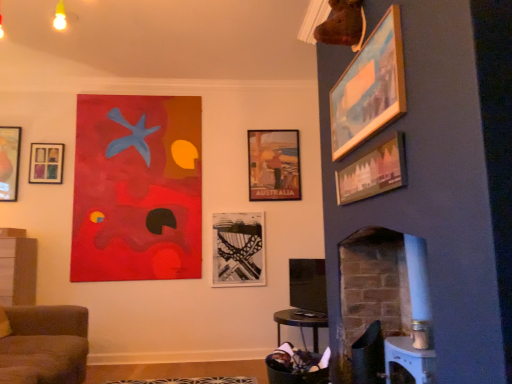
Question: Can you confirm if matte wooden picture frame at upper right, marked as the 5th picture frame in a left-to-right arrangement, is positioned to the right of wooden picture frame at upper right, which appears as the second picture frame when viewed from the front?

Choices:
 (A) yes
 (B) no

Answer: (B)

Question: Considering the relative sizes of matte wooden picture frame at upper right, the 1th picture frame in the front-to-back sequence, and wooden picture frame at upper right, which appears as the second picture frame when viewed from the front, in the image provided, is matte wooden picture frame at upper right, the 1th picture frame in the front-to-back sequence, bigger than wooden picture frame at upper right, which appears as the second picture frame when viewed from the front,?

Choices:
 (A) yes
 (B) no

Answer: (B)

Question: Can you confirm if matte wooden picture frame at upper right, the 1th picture frame in the front-to-back sequence, is shorter than wooden picture frame at upper right, placed as the fifth picture frame when sorted from back to front?

Choices:
 (A) no
 (B) yes

Answer: (B)

Question: Is the surface of matte wooden picture frame at upper right, marked as the 5th picture frame in a left-to-right arrangement, in direct contact with wooden picture frame at upper right, placed as the 6th picture frame when sorted from left to right?

Choices:
 (A) yes
 (B) no

Answer: (B)

Question: Could you tell me if matte wooden picture frame at upper right, the 6th picture frame when ordered from back to front, is turned towards wooden picture frame at upper right, placed as the fifth picture frame when sorted from back to front?

Choices:
 (A) no
 (B) yes

Answer: (A)

Question: From their relative heights in the image, would you say metallic silver swivel chair at lower right is taller or shorter than matte glass picture frame at upper left, which ranks as the second picture frame in left-to-right order?

Choices:
 (A) tall
 (B) short

Answer: (A)

Question: Based on their positions, is metallic silver swivel chair at lower right located to the left or right of matte glass picture frame at upper left, which is the 3th picture frame from back to front?

Choices:
 (A) left
 (B) right

Answer: (B)

Question: From the image's perspective, is metallic silver swivel chair at lower right located above or below matte glass picture frame at upper left, the 5th picture frame viewed from the right?

Choices:
 (A) below
 (B) above

Answer: (A)

Question: Relative to matte glass picture frame at upper left, which is the 3th picture frame from back to front, is metallic silver swivel chair at lower right in front or behind?

Choices:
 (A) front
 (B) behind

Answer: (A)

Question: Relative to white painted brick fireplace at right, is wooden picture frame at upper right, placed as the 6th picture frame when sorted from left to right, in front or behind?

Choices:
 (A) front
 (B) behind

Answer: (A)

Question: In terms of height, does wooden picture frame at upper right, which appears as the second picture frame when viewed from the front, look taller or shorter compared to white painted brick fireplace at right?

Choices:
 (A) short
 (B) tall

Answer: (A)

Question: Considering the positions of wooden picture frame at upper right, which appears as the second picture frame when viewed from the front, and white painted brick fireplace at right in the image, is wooden picture frame at upper right, which appears as the second picture frame when viewed from the front, bigger or smaller than white painted brick fireplace at right?

Choices:
 (A) small
 (B) big

Answer: (A)

Question: Considering the relative positions of wooden picture frame at upper right, placed as the fifth picture frame when sorted from back to front, and white painted brick fireplace at right in the image provided, is wooden picture frame at upper right, placed as the fifth picture frame when sorted from back to front, to the left or to the right of white painted brick fireplace at right?

Choices:
 (A) left
 (B) right

Answer: (A)

Question: From their relative heights in the image, would you say matte black picture frame at upper left, the 4th picture frame positioned from the back, is taller or shorter than brown fabric couch at lower left?

Choices:
 (A) short
 (B) tall

Answer: (A)

Question: Is matte black picture frame at upper left, positioned as the 3th picture frame in front-to-back order, spatially inside brown fabric couch at lower left, or outside of it?

Choices:
 (A) outside
 (B) inside

Answer: (A)